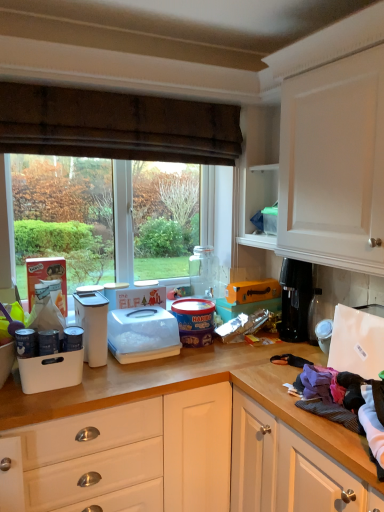
At what (x,y) coordinates should I click in order to perform the action: click on empty space that is ontop of orange matte box at center, which is the 2th box from top to bottom. Please return your answer as a coordinate pair (x, y). This screenshot has width=384, height=512. Looking at the image, I should click on (256, 296).